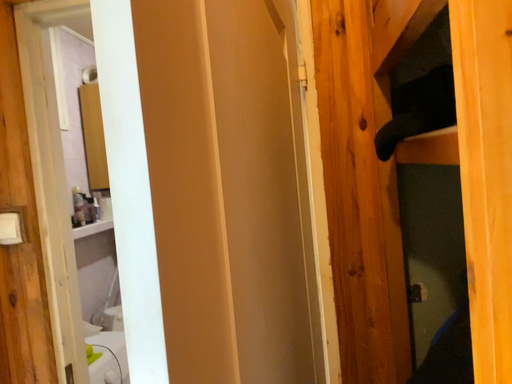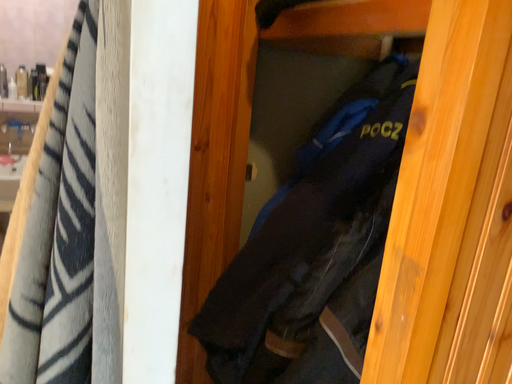
Question: Which way did the camera rotate in the video?

Choices:
 (A) rotated right
 (B) rotated left

Answer: (A)